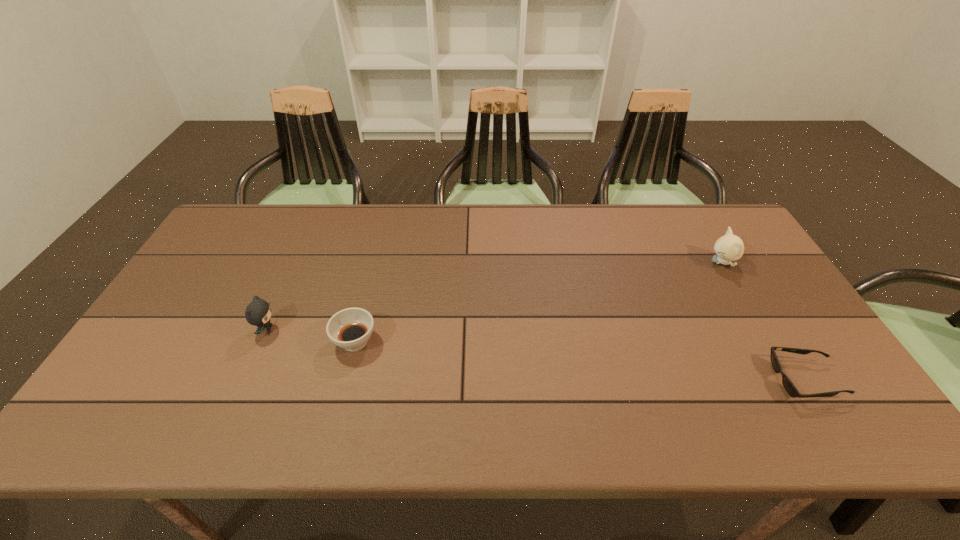
Where is `free space between the leftmost object and the third tallest object`? The image size is (960, 540). free space between the leftmost object and the third tallest object is located at coordinates coord(311,335).

Identify the location of empty space between the soup bowl and the sunglasses. (580, 361).

Where is `empty space that is in between the farther kitten and the soup bowl`? Image resolution: width=960 pixels, height=540 pixels. empty space that is in between the farther kitten and the soup bowl is located at coordinates (539, 302).

Identify the location of blank region between the farthest object and the soup bowl. (539, 302).

Locate an element on the screen. free space between the leftmost object and the shortest object is located at coordinates (536, 354).

Locate an element on the screen. Image resolution: width=960 pixels, height=540 pixels. object that is the closest to the nearer kitten is located at coordinates (350, 328).

Locate which object is the third closest to the right kitten. Please provide its 2D coordinates. Your answer should be formatted as a tuple, i.e. [(x, y)], where the tuple contains the x and y coordinates of a point satisfying the conditions above.

[(258, 312)]

In order to click on free space in the image that satisfies the following two spatial constraints: 1. on the front-facing side of the leftmost object; 2. on the left side of the soup bowl in this screenshot , I will do `click(261, 342)`.

You are a GUI agent. You are given a task and a screenshot of the screen. Output one action in this format:
    pyautogui.click(x=<x>, y=<y>)
    Task: Click on the vacant space that satisfies the following two spatial constraints: 1. on the face of the farther kitten; 2. on the front side of the soup bowl
    
    Given the screenshot: What is the action you would take?
    pyautogui.click(x=769, y=342)